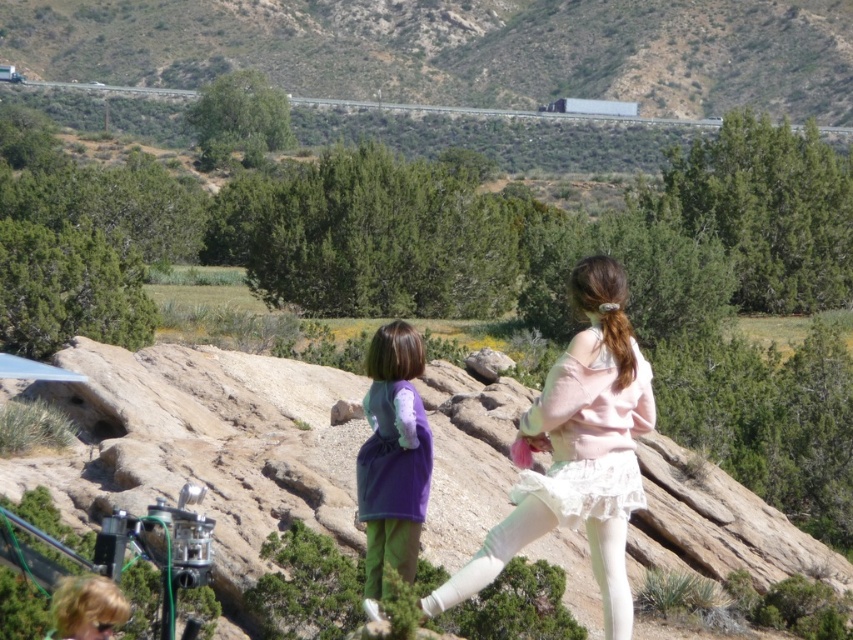
Question: Which object appears farthest from the camera in this image?

Choices:
 (A) purple fleece dress at center
 (B) pastel pink fabric skirt at center

Answer: (A)

Question: Which object is farther from the camera taking this photo?

Choices:
 (A) green grassy hillside at upper center
 (B) pastel pink fabric skirt at center
 (C) purple fleece dress at center

Answer: (A)

Question: Does pastel pink fabric skirt at center appear under purple fleece dress at center?

Choices:
 (A) no
 (B) yes

Answer: (B)

Question: Which point is closer to the camera?

Choices:
 (A) pastel pink fabric skirt at center
 (B) purple fleece dress at center
 (C) green grassy hillside at upper center

Answer: (A)

Question: Can you confirm if pastel pink fabric skirt at center is positioned to the right of purple fleece dress at center?

Choices:
 (A) no
 (B) yes

Answer: (B)

Question: Is green grassy hillside at upper center thinner than pastel pink fabric skirt at center?

Choices:
 (A) no
 (B) yes

Answer: (A)